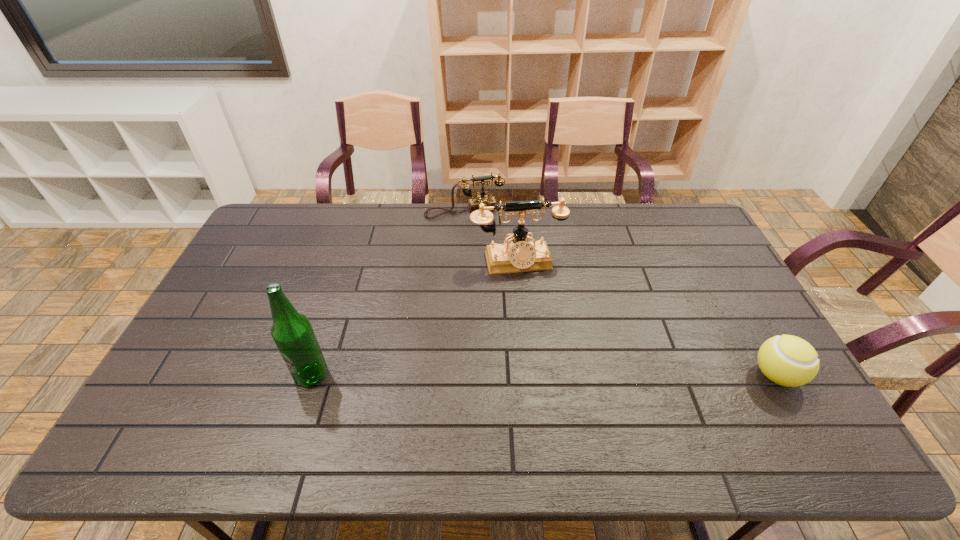
Image resolution: width=960 pixels, height=540 pixels. Identify the location of vacant space located 0.340m on the dial of the third nearest object. (547, 363).

Identify the location of free space located on the dial of the third nearest object. This screenshot has width=960, height=540. (544, 351).

Identify the location of vacant area situated 0.090m on the front-facing side of the farthest object. (477, 234).

Identify the location of free region located 0.100m on the front-facing side of the farthest object. The width and height of the screenshot is (960, 540). (478, 236).

Locate an element on the screen. This screenshot has height=540, width=960. free region located on the front-facing side of the farthest object is located at coordinates (491, 275).

Where is `object that is at the far edge`? The width and height of the screenshot is (960, 540). object that is at the far edge is located at coordinates (473, 204).

The height and width of the screenshot is (540, 960). Find the location of `beer bottle that is positioned at the near edge`. beer bottle that is positioned at the near edge is located at coordinates (292, 332).

The image size is (960, 540). I want to click on tennis ball at the near edge, so click(x=787, y=360).

Image resolution: width=960 pixels, height=540 pixels. Find the location of `object present at the right edge`. object present at the right edge is located at coordinates (787, 360).

Find the location of a particular element. object situated at the near right corner is located at coordinates (787, 360).